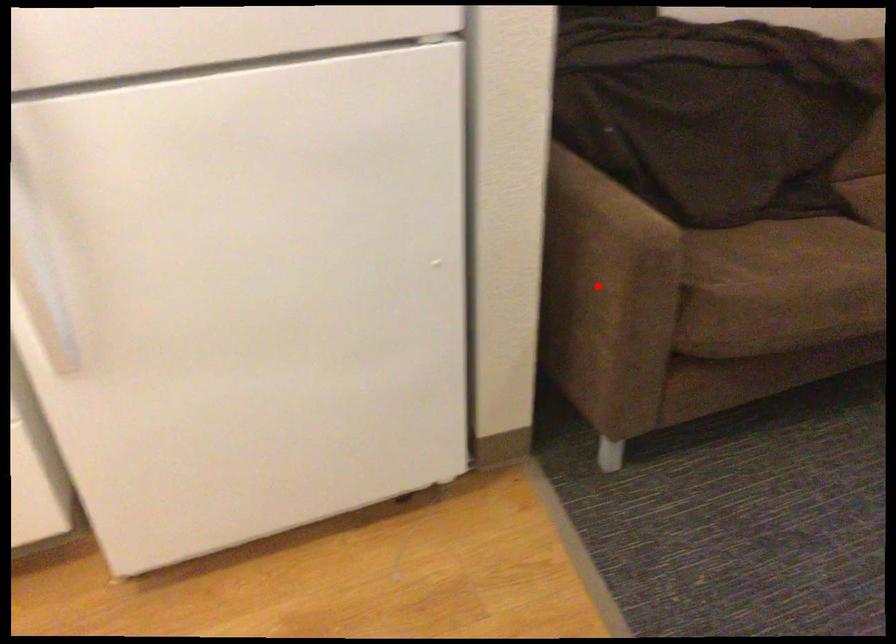
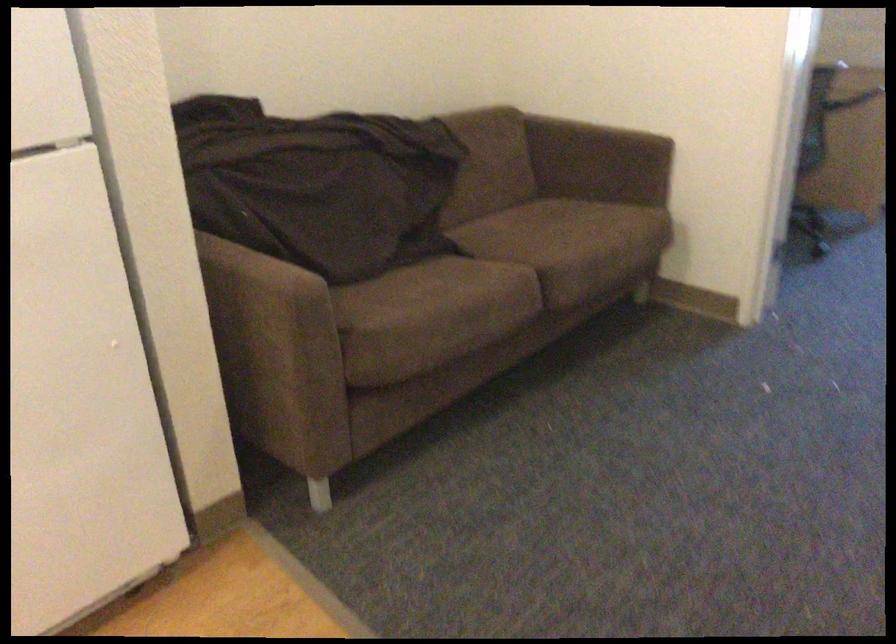
Question: I am providing you with two images of the same scene from different viewpoints. Given a red point in image1, look at the same physical point in image2. Is it:

Choices:
 (A) Closer to the viewpoint
 (B) Farther from the viewpoint

Answer: (B)